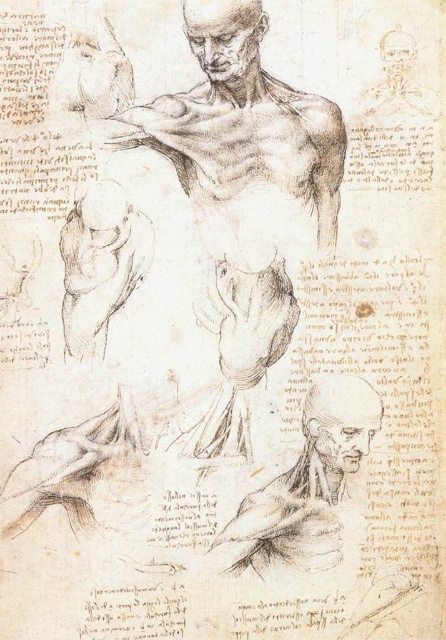
You are an art student analyzing this anatomical drawing. You notice two elements in the image. The first is the brown paper sketch of man at center, and the second is the smooth gray head at lower right. Based on their positions, which one is located higher up in the image?

The brown paper sketch of man at center is above the smooth gray head at lower right, so the brown paper sketch of man at center is higher up in the image.

Looking at the anatomical drawing of the muscular system, you notice two smooth gray heads. Which of these, the smooth gray head at lower right or the smooth gray head at upper center, is positioned lower in the drawing?

The smooth gray head at lower right is positioned below the smooth gray head at upper center, so it is the one located lower in the drawing.

Looking at the anatomical drawing of the human muscular system, you notice the brown paper sketch of man at center and the smooth gray head at upper center. Which object is positioned higher in the image?

The smooth gray head at upper center is positioned higher than the brown paper sketch of man at center.